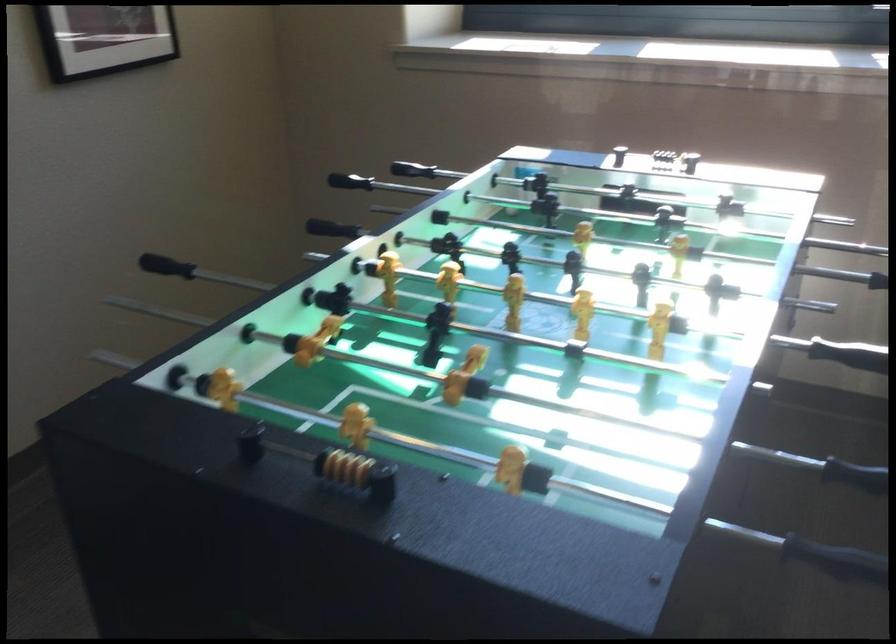
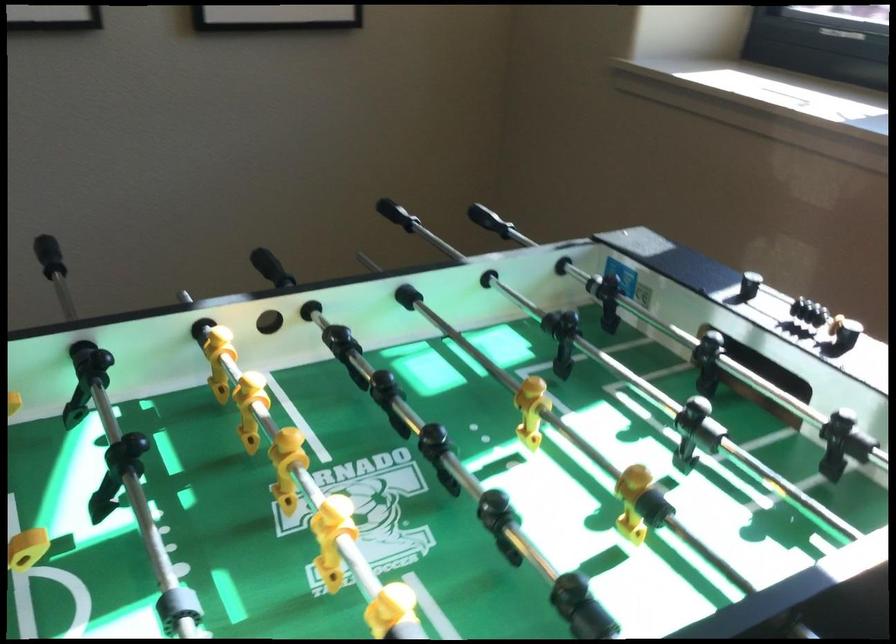
Question: The camera is either moving clockwise (left) or counter-clockwise (right) around the object. The first image is from the beginning of the video and the second image is from the end. Is the camera moving left or right when shooting the video?

Choices:
 (A) Left
 (B) Right

Answer: (B)